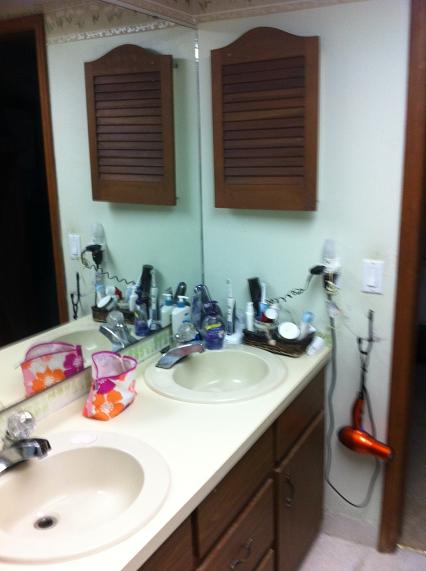
Where is `the right sink faucet`? This screenshot has width=426, height=571. the right sink faucet is located at coordinates (185, 341).